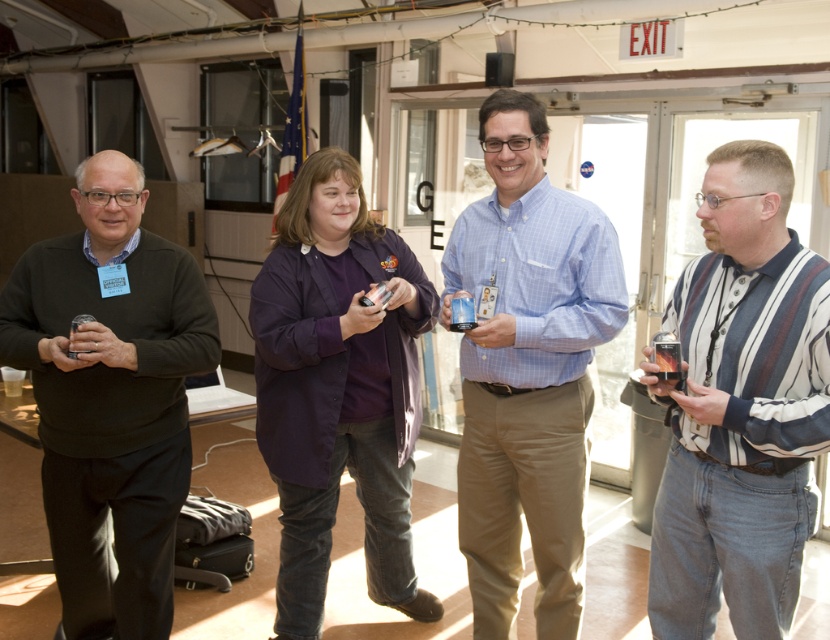
Is point (735, 557) farther from viewer compared to point (113, 323)?

That is False.

Is point (758, 419) farther from camera compared to point (105, 250)?

That is False.

The width and height of the screenshot is (830, 640). In order to click on striped cotton shirt at right in this screenshot , I will do `click(740, 406)`.

Does striped cotton shirt at right have a greater width compared to blue checkered shirt at center?

No.

Is striped cotton shirt at right to the left of blue checkered shirt at center from the viewer's perspective?

No, striped cotton shirt at right is not to the left of blue checkered shirt at center.

Is point (686, 385) more distant than point (511, 552)?

No, it is in front of (511, 552).

Locate an element on the screen. This screenshot has height=640, width=830. striped cotton shirt at right is located at coordinates [740, 406].

Is point (160, 620) less distant than point (465, 468)?

Yes, point (160, 620) is closer to viewer.

Does point (77, 488) come behind point (535, 300)?

No, it is not.

Where is `dark gray sweater at left`? Image resolution: width=830 pixels, height=640 pixels. dark gray sweater at left is located at coordinates (110, 397).